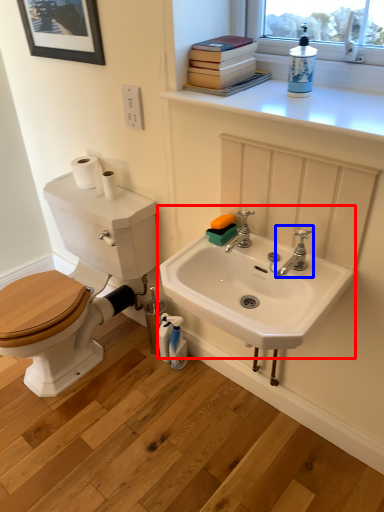
Question: Which of the following is the farthest to the observer, sink (highlighted by a red box) or tap (highlighted by a blue box)?

Choices:
 (A) sink
 (B) tap

Answer: (B)